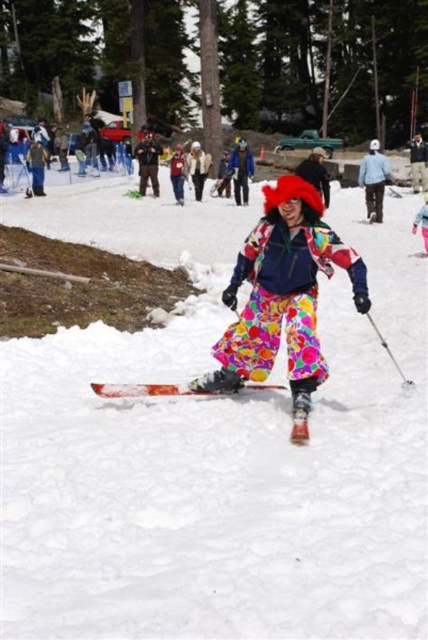
Question: Does matte black jacket at upper center have a smaller size compared to fluorescent yellow snow pants at center?

Choices:
 (A) yes
 (B) no

Answer: (A)

Question: Does orange metallic ski at center have a greater width compared to fluorescent multicolored pants at center?

Choices:
 (A) yes
 (B) no

Answer: (A)

Question: Estimate the real-world distances between objects in this image. Which object is farther from the white snow at center?

Choices:
 (A) fluorescent multicolored pants at center
 (B) matte black jacket at upper center
 (C) fluorescent yellow snow pants at center

Answer: (C)

Question: Is white snow at center above fluorescent multicolored pants at center?

Choices:
 (A) no
 (B) yes

Answer: (A)

Question: Which point is closer to the camera taking this photo?

Choices:
 (A) (193, 394)
 (B) (210, 156)
 (C) (419, 216)

Answer: (A)

Question: Which object is the closest to the fluorescent pink snowsuit at center?

Choices:
 (A) matte black jacket at upper center
 (B) orange metallic ski at center
 (C) fluorescent yellow snow pants at center

Answer: (B)